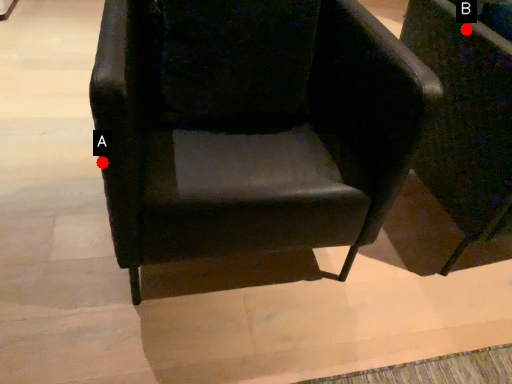
Question: Two points are circled on the image, labeled by A and B beside each circle. Which point is closer to the camera taking this photo?

Choices:
 (A) A is closer
 (B) B is closer

Answer: (A)